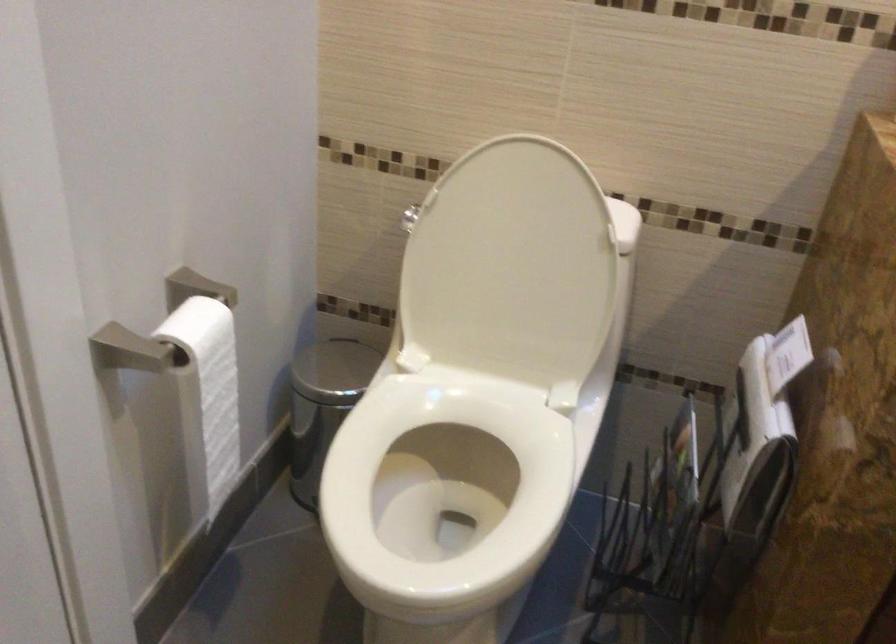
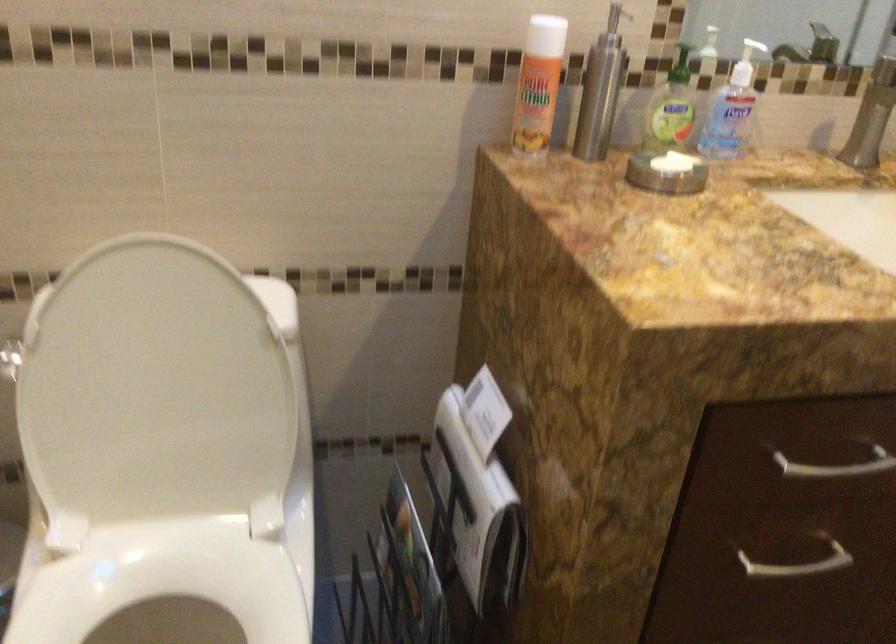
In the second image, find the point that corresponds to the point at 750,438 in the first image.

(477, 512)